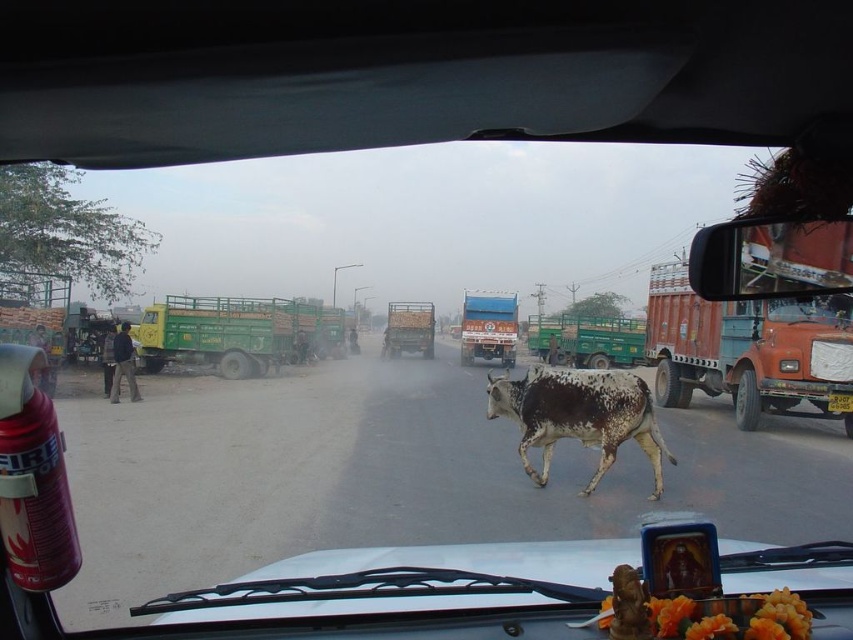
Is blue metallic truck at center below green painted truck at center?

Actually, blue metallic truck at center is above green painted truck at center.

Between point (503, 340) and point (424, 332), which one is positioned behind?

Point (424, 332)

Identify the location of blue metallic truck at center. (488, 326).

Image resolution: width=853 pixels, height=640 pixels. I want to click on blue metallic truck at center, so click(x=488, y=326).

Between point (479, 305) and point (848, 401), which one is positioned in front?

Point (848, 401) is more forward.

The image size is (853, 640). What are the coordinates of `blue metallic truck at center` in the screenshot? It's located at (488, 326).

Does green painted truck at center appear over yellow plastic license plate at center?

Correct, green painted truck at center is located above yellow plastic license plate at center.

Does point (421, 323) come farther from viewer compared to point (851, 396)?

Yes, it is.

I want to click on green painted truck at center, so click(409, 328).